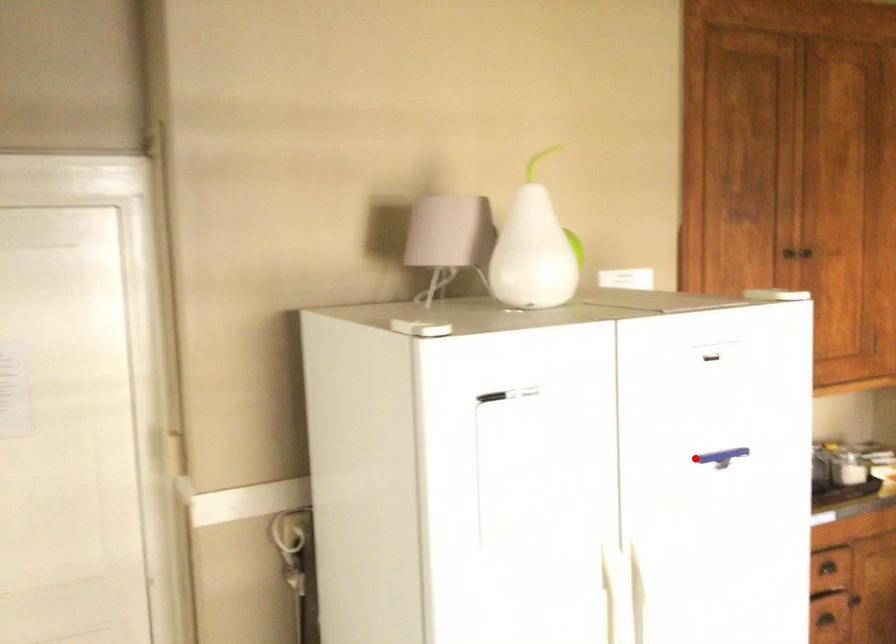
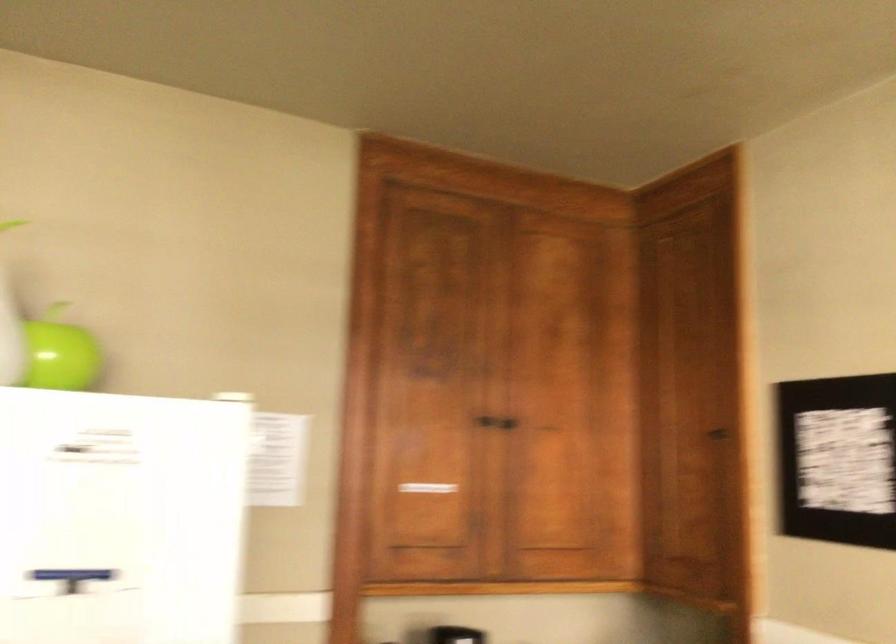
The point at the highlighted location is marked in the first image. Where is the corresponding point in the second image?

(72, 574)